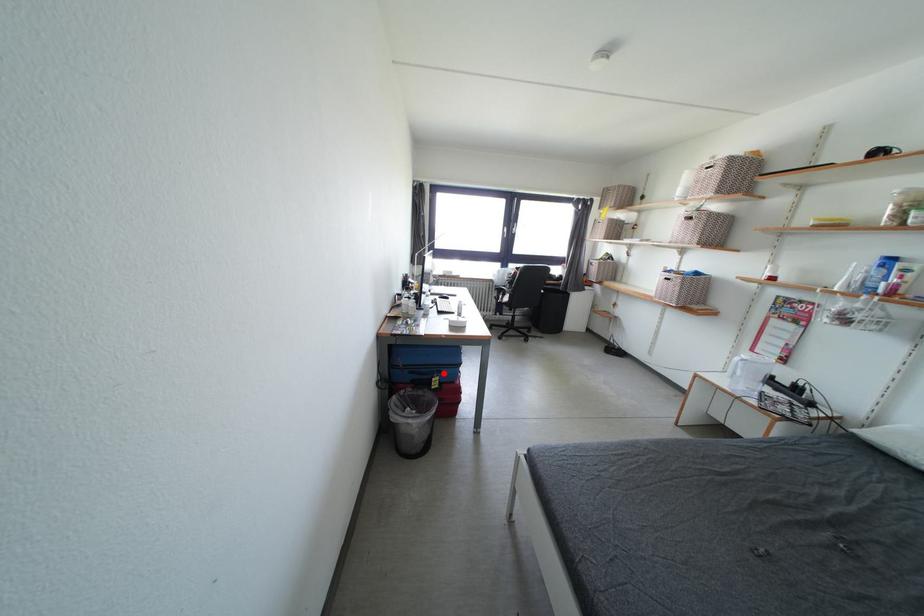
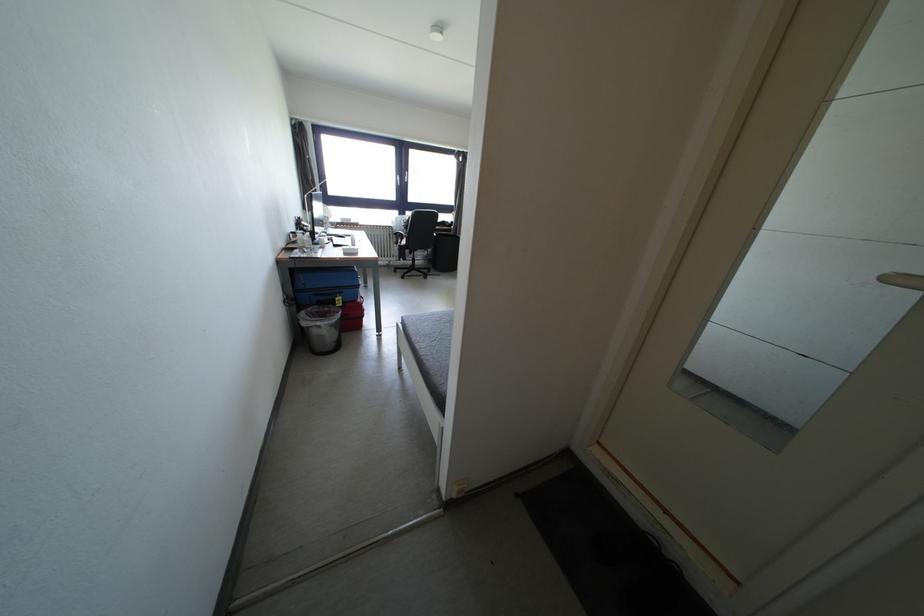
Question: I am providing you with two images of the same scene from different viewpoints. A red point is shown in image1. For the corresponding object point in image2, is it positioned nearer or farther from the camera?

Choices:
 (A) Nearer
 (B) Farther

Answer: (A)